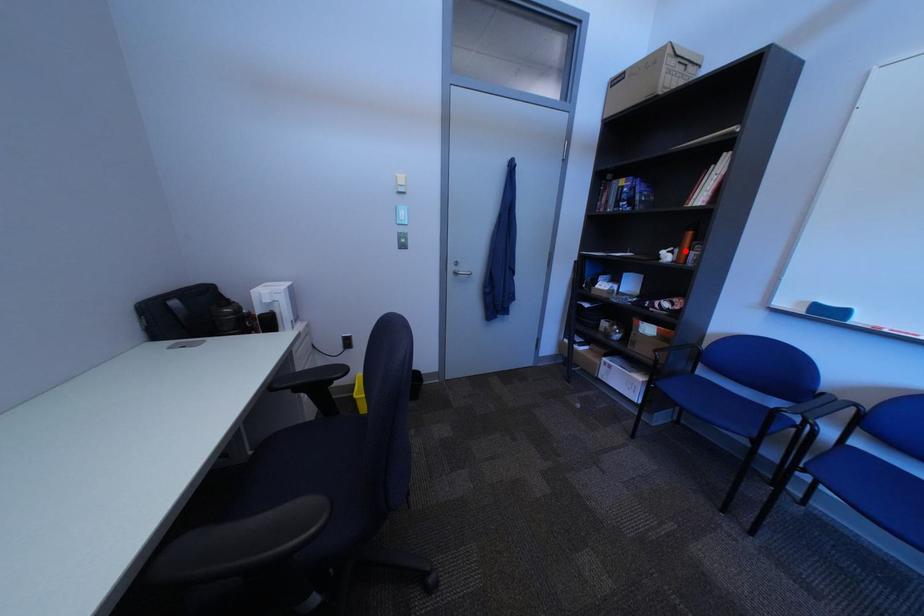
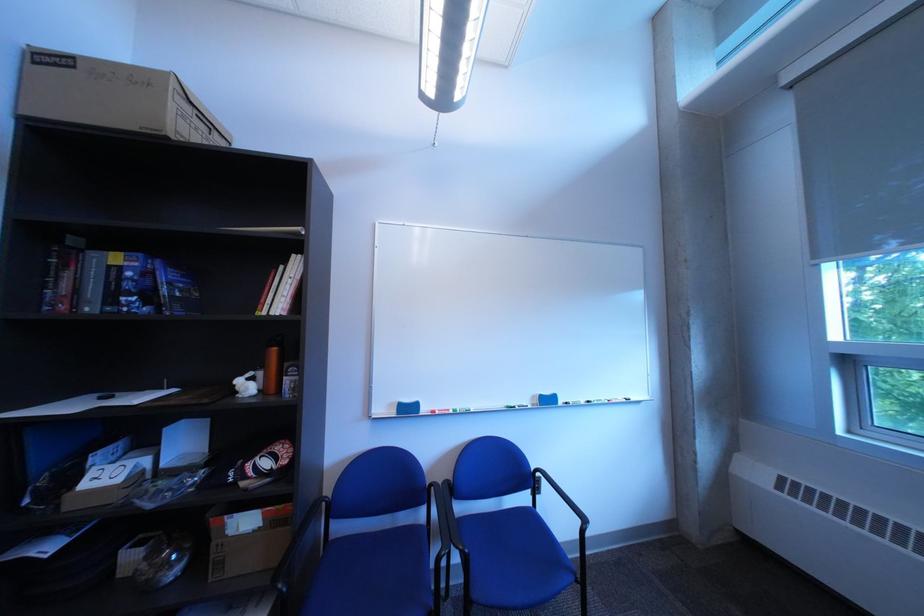
Locate, in the second image, the point that corresponds to the highlighted location in the first image.

(264, 376)